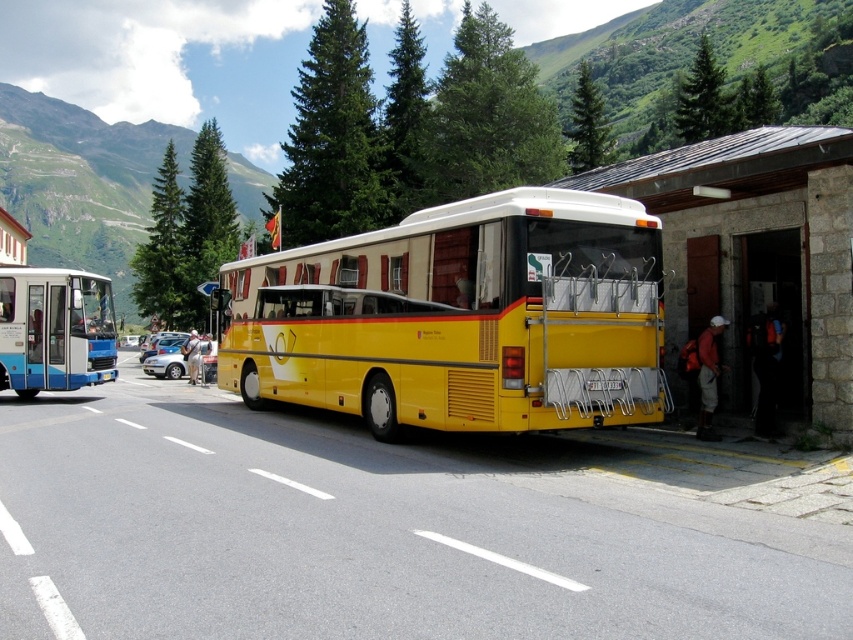
Question: Which point is closer to the camera taking this photo?

Choices:
 (A) (155, 356)
 (B) (403, 380)

Answer: (B)

Question: Which is farther from the blue metallic bus at left?

Choices:
 (A) silver metallic car at center-left
 (B) yellow matte bus at right
 (C) yellow matte bus at center

Answer: (B)

Question: Is yellow matte bus at center smaller than silver metallic car at center-left?

Choices:
 (A) yes
 (B) no

Answer: (B)

Question: Among these objects, which one is nearest to the camera?

Choices:
 (A) yellow matte bus at right
 (B) blue metallic bus at left
 (C) silver metallic car at center-left

Answer: (A)

Question: Does yellow matte bus at right appear on the left side of blue metallic bus at left?

Choices:
 (A) no
 (B) yes

Answer: (A)

Question: Is yellow matte bus at center thinner than blue metallic bus at left?

Choices:
 (A) yes
 (B) no

Answer: (B)